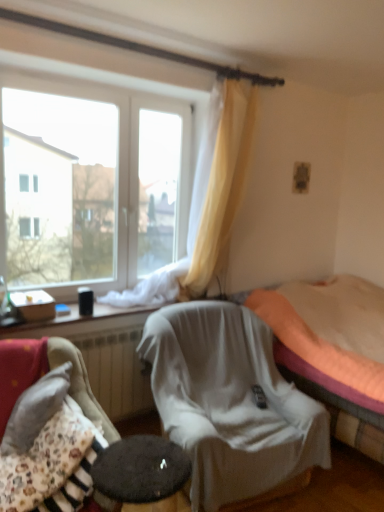
Question: Is orange fabric bed at center surrounding floral fabric cushion at lower left, placed as the first chair when sorted from front to back?

Choices:
 (A) no
 (B) yes

Answer: (A)

Question: Does orange fabric bed at center have a lesser width compared to floral fabric cushion at lower left, which is the second chair in back-to-front order?

Choices:
 (A) yes
 (B) no

Answer: (B)

Question: Is orange fabric bed at center oriented towards floral fabric cushion at lower left, placed as the first chair when sorted from front to back?

Choices:
 (A) no
 (B) yes

Answer: (B)

Question: Does orange fabric bed at center appear on the right side of floral fabric cushion at lower left, which is the second chair in back-to-front order?

Choices:
 (A) yes
 (B) no

Answer: (A)

Question: Does orange fabric bed at center come behind floral fabric cushion at lower left, which ranks as the 2th chair in right-to-left order?

Choices:
 (A) no
 (B) yes

Answer: (B)

Question: Is orange fabric bed at center taller than floral fabric cushion at lower left, positioned as the 1th chair in left-to-right order?

Choices:
 (A) no
 (B) yes

Answer: (B)

Question: Is black glossy coffee cup at lower left not inside floral fabric cushion at lower left, which is the second chair in back-to-front order?

Choices:
 (A) no
 (B) yes

Answer: (B)

Question: Does black glossy coffee cup at lower left come behind floral fabric cushion at lower left, placed as the first chair when sorted from front to back?

Choices:
 (A) no
 (B) yes

Answer: (B)

Question: Would you say black glossy coffee cup at lower left is a long distance from floral fabric cushion at lower left, which is the second chair in back-to-front order?

Choices:
 (A) no
 (B) yes

Answer: (A)

Question: From the image's perspective, is black glossy coffee cup at lower left above floral fabric cushion at lower left, which ranks as the 2th chair in right-to-left order?

Choices:
 (A) yes
 (B) no

Answer: (A)

Question: Considering the relative sizes of black glossy coffee cup at lower left and floral fabric cushion at lower left, positioned as the 1th chair in left-to-right order, in the image provided, is black glossy coffee cup at lower left shorter than floral fabric cushion at lower left, positioned as the 1th chair in left-to-right order,?

Choices:
 (A) yes
 (B) no

Answer: (A)

Question: Is black glossy coffee cup at lower left aimed at floral fabric cushion at lower left, which is the second chair in back-to-front order?

Choices:
 (A) no
 (B) yes

Answer: (A)

Question: Is floral fabric cushion at lower left, which ranks as the 2th chair in right-to-left order, to the right of orange fabric bed at center from the viewer's perspective?

Choices:
 (A) no
 (B) yes

Answer: (A)